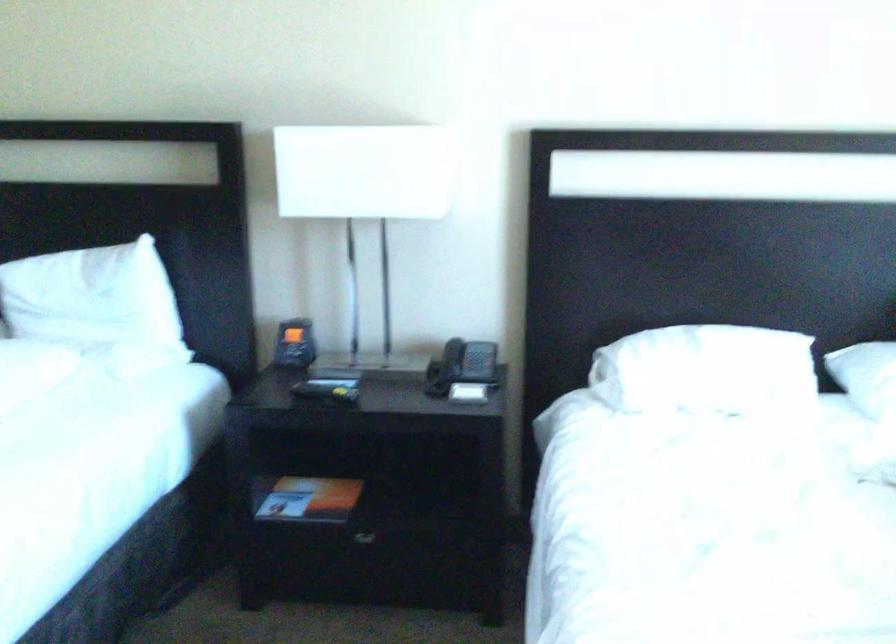
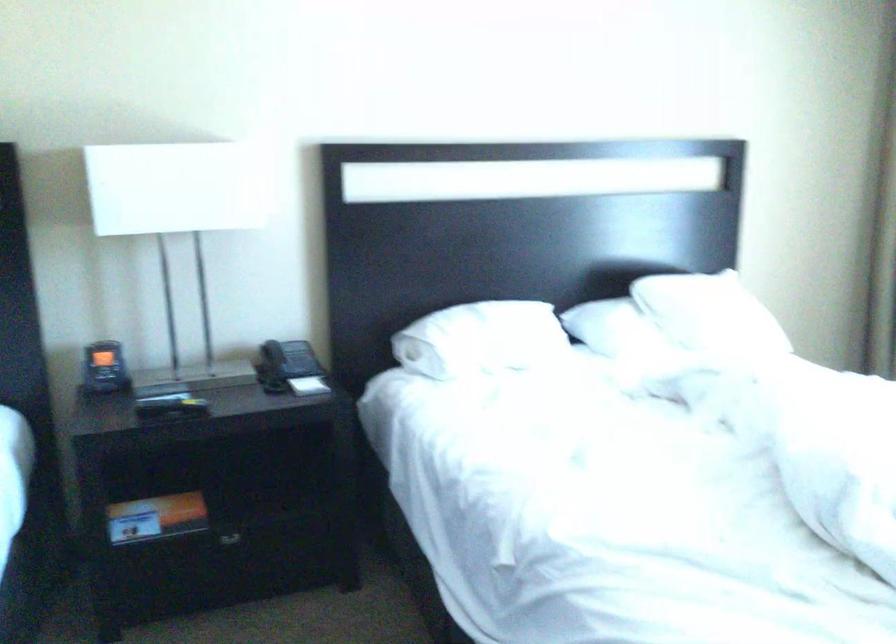
Where in the second image is the point corresponding to the point at 289,341 from the first image?

(104, 368)